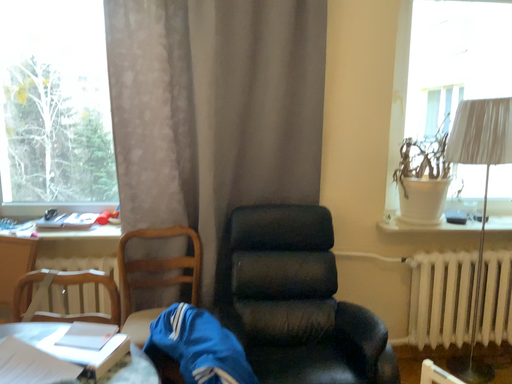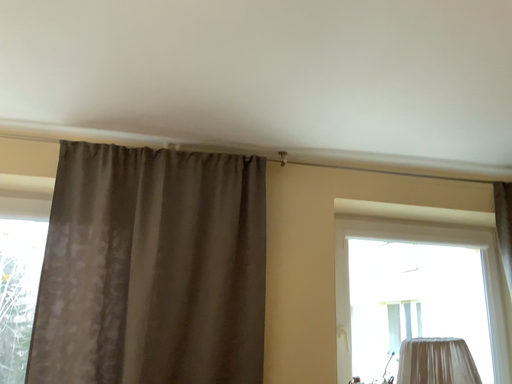
Question: How did the camera likely rotate when shooting the video?

Choices:
 (A) rotated downward
 (B) rotated upward

Answer: (B)